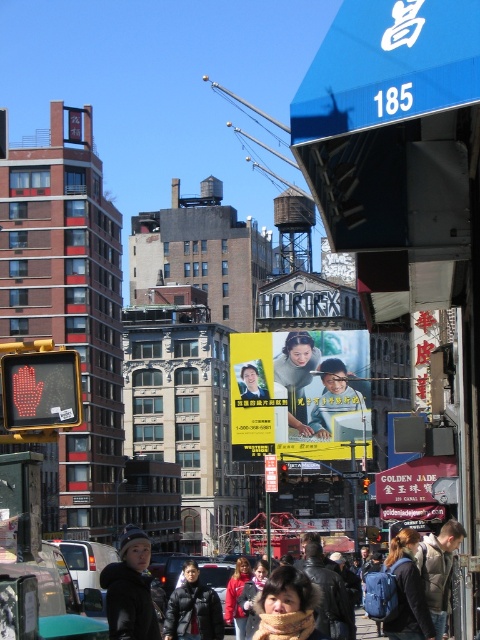
Does point (431, 609) come farther from viewer compared to point (243, 586)?

That is False.

Where is `dark gray jacket at center`? The height and width of the screenshot is (640, 480). dark gray jacket at center is located at coordinates (439, 570).

Locate an element on the screen. This screenshot has width=480, height=640. dark gray jacket at center is located at coordinates (439, 570).

Can you confirm if yellow paper advertisement at center is smaller than dark gray jacket at center?

No, yellow paper advertisement at center is not smaller than dark gray jacket at center.

Is yellow paper advertisement at center wider than dark gray jacket at center?

Yes, yellow paper advertisement at center is wider than dark gray jacket at center.

Between point (361, 365) and point (444, 538), which one is positioned behind?

Positioned behind is point (361, 365).

Locate an element on the screen. This screenshot has width=480, height=640. yellow paper advertisement at center is located at coordinates (300, 392).

Looking at this image, is red jacket at center closer to camera compared to matte black jacket at center?

No, red jacket at center is further to the viewer.

Which is in front, point (238, 602) or point (257, 570)?

Point (238, 602) is more forward.

This screenshot has width=480, height=640. I want to click on red jacket at center, so click(237, 596).